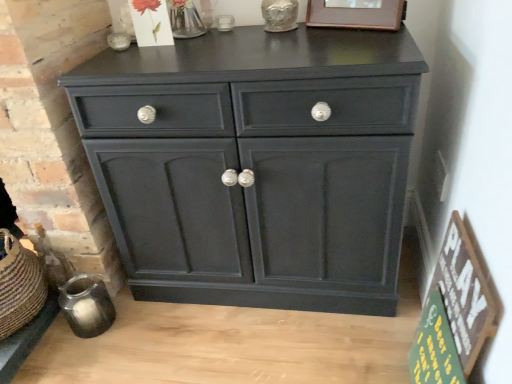
Question: Is wooden sign at lower right, the 1th bulletin board viewed from the top, positioned in front of wooden picture frame at upper center?

Choices:
 (A) yes
 (B) no

Answer: (A)

Question: Is wooden sign at lower right, the 2th bulletin board in the bottom-to-top sequence, not within wooden picture frame at upper center?

Choices:
 (A) no
 (B) yes

Answer: (B)

Question: From a real-world perspective, is wooden sign at lower right, the 2th bulletin board in the bottom-to-top sequence, over wooden picture frame at upper center?

Choices:
 (A) yes
 (B) no

Answer: (B)

Question: Is wooden sign at lower right, the 1th bulletin board viewed from the top, facing towards wooden picture frame at upper center?

Choices:
 (A) yes
 (B) no

Answer: (B)

Question: Does wooden sign at lower right, the 2th bulletin board in the bottom-to-top sequence, have a larger size compared to wooden picture frame at upper center?

Choices:
 (A) yes
 (B) no

Answer: (A)

Question: Looking at the image, does matte black cabinet at center seem bigger or smaller compared to wooden sign at lower right, the 2th bulletin board in the bottom-to-top sequence?

Choices:
 (A) small
 (B) big

Answer: (B)

Question: Does point (292, 48) appear closer or farther from the camera than point (470, 307)?

Choices:
 (A) closer
 (B) farther

Answer: (B)

Question: Is matte black cabinet at center wider or thinner than wooden sign at lower right, the 2th bulletin board in the bottom-to-top sequence?

Choices:
 (A) wide
 (B) thin

Answer: (A)

Question: Considering their positions, is matte black cabinet at center located in front of or behind wooden sign at lower right, the 1th bulletin board viewed from the top?

Choices:
 (A) front
 (B) behind

Answer: (B)

Question: From the image's perspective, is wooden picture frame at upper center above or below matte black cabinet at center?

Choices:
 (A) above
 (B) below

Answer: (A)

Question: Looking at their shapes, would you say wooden picture frame at upper center is wider or thinner than matte black cabinet at center?

Choices:
 (A) thin
 (B) wide

Answer: (A)

Question: From their relative heights in the image, would you say wooden picture frame at upper center is taller or shorter than matte black cabinet at center?

Choices:
 (A) tall
 (B) short

Answer: (B)

Question: Is wooden picture frame at upper center inside the boundaries of matte black cabinet at center, or outside?

Choices:
 (A) inside
 (B) outside

Answer: (B)

Question: In terms of size, does green wood sign at lower right, the 2th bulletin board viewed from the top, appear bigger or smaller than matte black cabinet at center?

Choices:
 (A) small
 (B) big

Answer: (A)

Question: Considering the positions of point (421, 374) and point (278, 243), is point (421, 374) closer or farther from the camera than point (278, 243)?

Choices:
 (A) farther
 (B) closer

Answer: (B)